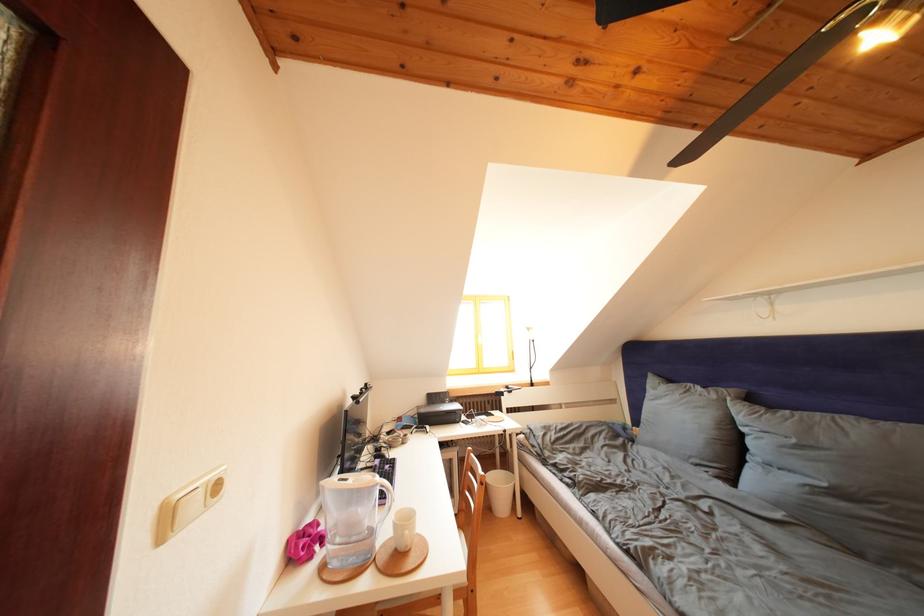
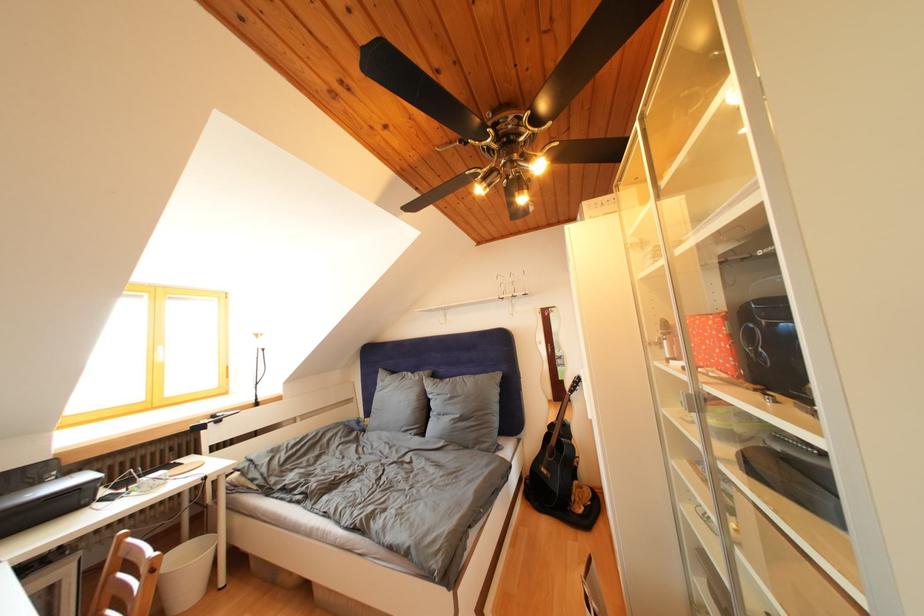
Find the pixel in the second image that matches [451,407] in the first image.

(44, 488)